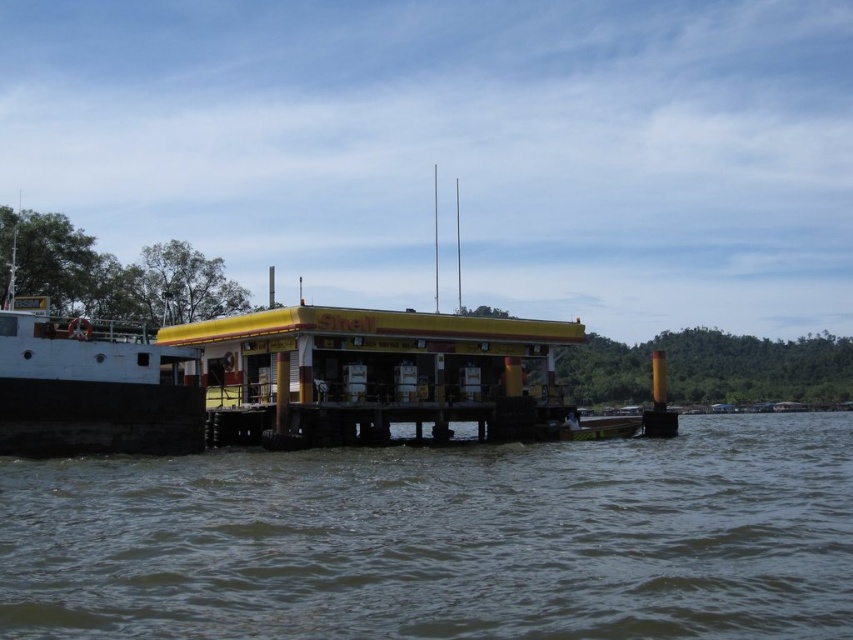
You are standing on a boat and looking at the brown murky water at lower center. The boat has a safety guideline stating that you must stay at least 10 meters away from any water surface to avoid contamination. Are you within the safe distance according to the guideline?

The distance between you and the brown murky water at lower center is 9.23 meters, which is less than the required 10 meters safety guideline. Therefore, you are not within the safe distance and should move further away.

You are standing at the point marked by the coordinates (444, 540) in the image. Describe what you see around you.

You are standing in the brown murky water at lower center marked by the coordinates (444, 540).

You are a delivery person arriving at the floating gas station by boat. Your boat is the white matte boat at left. You need to secure your boat to the structure. Where should you position your boat relative to the brown murky water at lower center?

The brown murky water at lower center is positioned under the white matte boat at left, so you should position your boat at the left side where it is already located above the brown murky water at lower center to secure it to the structure.